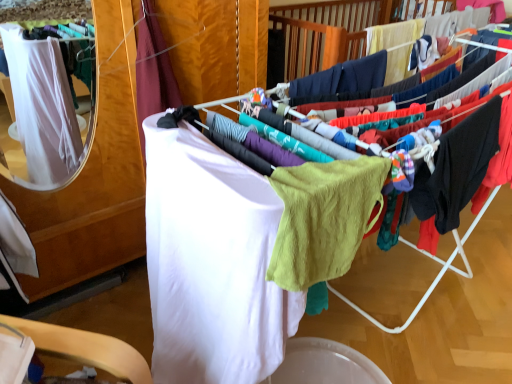
Question: From the image's perspective, is black cotton hoodie at right, the 1th clothing in the right-to-left sequence, beneath lime green knit sweater at center?

Choices:
 (A) yes
 (B) no

Answer: (B)

Question: Is black cotton hoodie at right, the 3th clothing in the left-to-right sequence, smaller than lime green knit sweater at center?

Choices:
 (A) no
 (B) yes

Answer: (B)

Question: Considering the relative sizes of black cotton hoodie at right, the 3th clothing in the left-to-right sequence, and lime green knit sweater at center in the image provided, is black cotton hoodie at right, the 3th clothing in the left-to-right sequence, bigger than lime green knit sweater at center?

Choices:
 (A) no
 (B) yes

Answer: (A)

Question: Is black cotton hoodie at right, the 1th clothing in the right-to-left sequence, touching lime green knit sweater at center?

Choices:
 (A) yes
 (B) no

Answer: (B)

Question: Would you say black cotton hoodie at right, the 1th clothing in the right-to-left sequence, is outside lime green knit sweater at center?

Choices:
 (A) no
 (B) yes

Answer: (B)

Question: From their relative heights in the image, would you say white soft towel at center, the second clothing in the right-to-left sequence, is taller or shorter than lime green knit sweater at center?

Choices:
 (A) tall
 (B) short

Answer: (A)

Question: From a real-world perspective, is white soft towel at center, the second clothing in the left-to-right sequence, above or below lime green knit sweater at center?

Choices:
 (A) below
 (B) above

Answer: (A)

Question: In terms of size, does white soft towel at center, the second clothing in the left-to-right sequence, appear bigger or smaller than lime green knit sweater at center?

Choices:
 (A) small
 (B) big

Answer: (B)

Question: Would you say white soft towel at center, the second clothing in the left-to-right sequence, is inside or outside lime green knit sweater at center?

Choices:
 (A) outside
 (B) inside

Answer: (A)

Question: From the image's perspective, relative to white soft towel at center, the second clothing in the right-to-left sequence, is white fabric at left, the 3th clothing positioned from the right, above or below?

Choices:
 (A) below
 (B) above

Answer: (B)

Question: From a real-world perspective, relative to white soft towel at center, the second clothing in the left-to-right sequence, is white fabric at left, the 3th clothing positioned from the right, vertically above or below?

Choices:
 (A) below
 (B) above

Answer: (B)

Question: Considering the positions of white fabric at left, the 3th clothing positioned from the right, and white soft towel at center, the second clothing in the right-to-left sequence, in the image, is white fabric at left, the 3th clothing positioned from the right, wider or thinner than white soft towel at center, the second clothing in the right-to-left sequence,?

Choices:
 (A) thin
 (B) wide

Answer: (A)

Question: Is point (141, 16) closer or farther from the camera than point (233, 269)?

Choices:
 (A) farther
 (B) closer

Answer: (A)

Question: Is white fabric at center inside or outside of lime green knit sweater at center?

Choices:
 (A) inside
 (B) outside

Answer: (B)

Question: From a real-world perspective, relative to lime green knit sweater at center, is white fabric at center vertically above or below?

Choices:
 (A) below
 (B) above

Answer: (A)